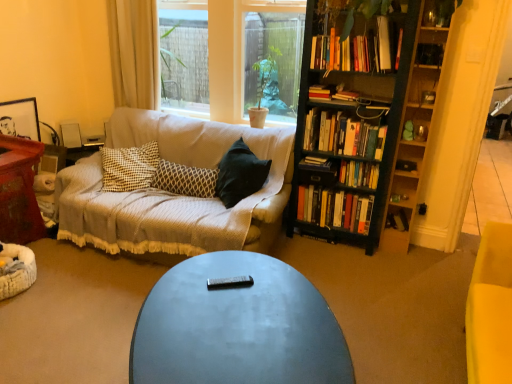
Question: From the image's perspective, is black wood bookcase at right under hardcover books at right, the 7th book in the top-to-bottom sequence?

Choices:
 (A) yes
 (B) no

Answer: (B)

Question: Considering the relative sizes of black wood bookcase at right and hardcover books at right, the 2th book when ordered from bottom to top, in the image provided, is black wood bookcase at right shorter than hardcover books at right, the 2th book when ordered from bottom to top,?

Choices:
 (A) no
 (B) yes

Answer: (A)

Question: Is black wood bookcase at right positioned with its back to hardcover books at right, the 7th book in the top-to-bottom sequence?

Choices:
 (A) no
 (B) yes

Answer: (B)

Question: Does black wood bookcase at right appear on the left side of hardcover books at right, the 7th book in the top-to-bottom sequence?

Choices:
 (A) no
 (B) yes

Answer: (A)

Question: Is black wood bookcase at right not inside hardcover books at right, the 7th book in the top-to-bottom sequence?

Choices:
 (A) yes
 (B) no

Answer: (A)

Question: From a real-world perspective, is black wood bookcase at right over hardcover books at right, the 2th book when ordered from bottom to top?

Choices:
 (A) yes
 (B) no

Answer: (A)

Question: From a real-world perspective, is matte black coffee table at center positioned under black wood bookcase at right based on gravity?

Choices:
 (A) yes
 (B) no

Answer: (A)

Question: Is matte black coffee table at center shorter than black wood bookcase at right?

Choices:
 (A) no
 (B) yes

Answer: (B)

Question: Is matte black coffee table at center at the right side of black wood bookcase at right?

Choices:
 (A) yes
 (B) no

Answer: (B)

Question: Is the depth of matte black coffee table at center greater than that of black wood bookcase at right?

Choices:
 (A) no
 (B) yes

Answer: (A)

Question: Can you confirm if matte black coffee table at center is bigger than black wood bookcase at right?

Choices:
 (A) yes
 (B) no

Answer: (B)

Question: From the image's perspective, is matte black coffee table at center over black wood bookcase at right?

Choices:
 (A) yes
 (B) no

Answer: (B)

Question: Is clear glass window at center further to the viewer compared to hardcover book at upper center, arranged as the 7th book when ordered from the bottom?

Choices:
 (A) yes
 (B) no

Answer: (A)